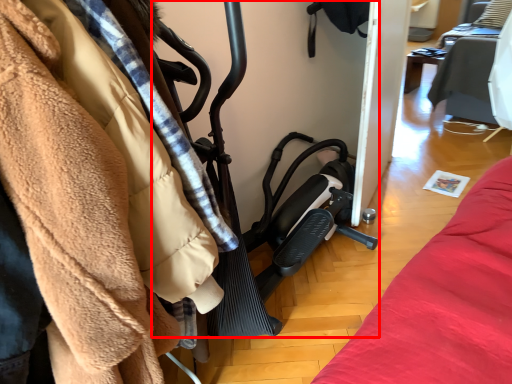
Question: Considering the relative positions of baby carriage (annotated by the red box) and furniture in the image provided, where is baby carriage (annotated by the red box) located with respect to the staircase?

Choices:
 (A) right
 (B) left

Answer: (B)